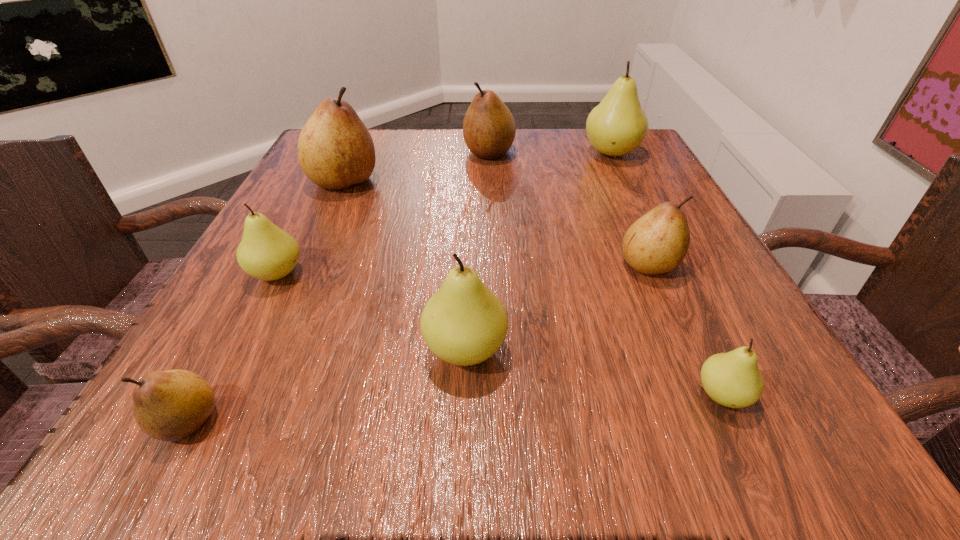
In order to click on the farthest green pear in this screenshot , I will do `click(618, 125)`.

I want to click on the biggest brown pear, so click(x=335, y=150).

This screenshot has height=540, width=960. I want to click on the second brown pear from right to left, so click(489, 128).

Locate an element on the screen. The height and width of the screenshot is (540, 960). the third smallest green pear is located at coordinates (464, 323).

The width and height of the screenshot is (960, 540). In order to click on the third farthest brown pear in this screenshot , I will do `click(656, 243)`.

Where is `the second smallest brown pear`? the second smallest brown pear is located at coordinates (656, 243).

I want to click on the second smallest green pear, so click(266, 252).

At what (x,y) coordinates should I click in order to perform the action: click on the second farthest green pear. Please return your answer as a coordinate pair (x, y). Image resolution: width=960 pixels, height=540 pixels. Looking at the image, I should click on (266, 252).

The height and width of the screenshot is (540, 960). I want to click on the smallest green pear, so click(733, 379).

Where is `the nearest brown pear`? This screenshot has width=960, height=540. the nearest brown pear is located at coordinates (170, 405).